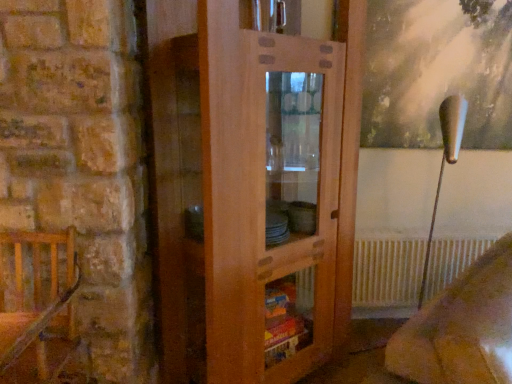
Question: Is velvet beige armchair at lower right a part of wooden chair at left?

Choices:
 (A) no
 (B) yes

Answer: (A)

Question: From the image's perspective, is wooden chair at left beneath velvet beige armchair at lower right?

Choices:
 (A) no
 (B) yes

Answer: (A)

Question: Does wooden chair at left have a greater height compared to velvet beige armchair at lower right?

Choices:
 (A) no
 (B) yes

Answer: (A)

Question: Could you tell me if wooden chair at left is turned towards velvet beige armchair at lower right?

Choices:
 (A) yes
 (B) no

Answer: (B)

Question: Can you confirm if wooden chair at left is smaller than velvet beige armchair at lower right?

Choices:
 (A) no
 (B) yes

Answer: (B)

Question: Is wooden chair at left looking in the opposite direction of velvet beige armchair at lower right?

Choices:
 (A) yes
 (B) no

Answer: (B)

Question: Would you consider wooden chair at left to be distant from white metallic radiator at lower right?

Choices:
 (A) yes
 (B) no

Answer: (A)

Question: Considering the relative sizes of wooden chair at left and white metallic radiator at lower right in the image provided, is wooden chair at left smaller than white metallic radiator at lower right?

Choices:
 (A) yes
 (B) no

Answer: (B)

Question: From the image's perspective, would you say wooden chair at left is shown under white metallic radiator at lower right?

Choices:
 (A) yes
 (B) no

Answer: (B)

Question: From a real-world perspective, is wooden chair at left beneath white metallic radiator at lower right?

Choices:
 (A) yes
 (B) no

Answer: (B)

Question: Is wooden chair at left outside white metallic radiator at lower right?

Choices:
 (A) yes
 (B) no

Answer: (A)

Question: From a real-world perspective, is wooden chair at left over white metallic radiator at lower right?

Choices:
 (A) yes
 (B) no

Answer: (A)

Question: From the image's perspective, is wooden cabinet at center on white metallic radiator at lower right?

Choices:
 (A) yes
 (B) no

Answer: (A)